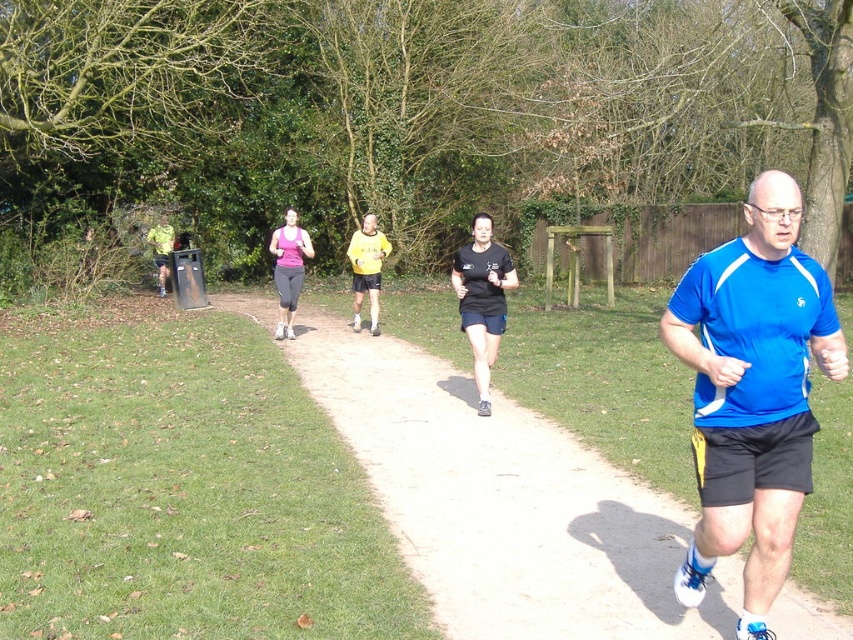
You are a photographer positioned at the starting line of a race. You want to capture a photo of both the blue fabric shirt at center and the yellow jersey at center. Based on their positions, which runner is closer to the camera?

The blue fabric shirt at center is wider than the yellow jersey at center, which suggests it is closer to the camera.

You are a photographer standing at the starting line of a race. You notice two runners ahead of you, one wearing a blue fabric shirt at center and the other wearing a yellow jersey at center. Which runner is wearing a larger top?

The blue fabric shirt at center has a larger size compared to the yellow jersey at center, so the runner wearing the blue fabric shirt at center has the larger top.

You are a photographer standing at the starting line of a race. You want to take a photo of both the blue fabric shirt at center and the yellow jersey at center so that both are fully visible in the frame. Given their sizes, which runner should you focus on to ensure both are captured without cropping?

The blue fabric shirt at center is taller than the yellow jersey at center. To ensure both are fully visible in the photo, focus on the blue fabric shirt at center since it is taller, allowing the shorter yellow jersey at center to also fit within the frame.